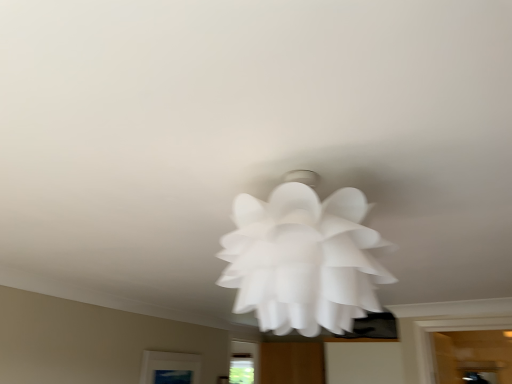
Measure the distance between point [314,274] and camera.

Point [314,274] is 79.50 centimeters away from camera.

The width and height of the screenshot is (512, 384). Describe the element at coordinates (303, 258) in the screenshot. I see `white paper flower at center` at that location.

I want to click on white paper flower at center, so click(303, 258).

This screenshot has height=384, width=512. Describe the element at coordinates (170, 368) in the screenshot. I see `matte glass window at lower center` at that location.

The width and height of the screenshot is (512, 384). Find the location of `matte glass window at lower center`. matte glass window at lower center is located at coordinates (170, 368).

You are a GUI agent. You are given a task and a screenshot of the screen. Output one action in this format:
    pyautogui.click(x=<x>, y=<y>)
    Task: Click on the white paper flower at center
    The image size is (512, 384).
    Given the screenshot: What is the action you would take?
    pyautogui.click(x=303, y=258)

Which is more to the right, white paper flower at center or matte glass window at lower center?

white paper flower at center.

Is white paper flower at center positioned behind matte glass window at lower center?

No, it is in front of matte glass window at lower center.

Which is more distant, (343, 195) or (153, 365)?

Positioned behind is point (153, 365).

From the image's perspective, is white paper flower at center located above or below matte glass window at lower center?

Clearly, from the image's perspective, white paper flower at center is above matte glass window at lower center.

From a real-world perspective, which is physically above, white paper flower at center or matte glass window at lower center?

white paper flower at center, from a real-world perspective.

Which object is thinner, white paper flower at center or matte glass window at lower center?

Thinner between the two is matte glass window at lower center.

Is white paper flower at center taller than matte glass window at lower center?

Correct, white paper flower at center is much taller as matte glass window at lower center.

Does white paper flower at center have a larger size compared to matte glass window at lower center?

Indeed, white paper flower at center has a larger size compared to matte glass window at lower center.

Does white paper flower at center contain matte glass window at lower center?

That's incorrect, matte glass window at lower center is not inside white paper flower at center.

Is white paper flower at center placed right next to matte glass window at lower center?

No.

Is white paper flower at center facing away from matte glass window at lower center?

white paper flower at center does not have its back to matte glass window at lower center.

How many degrees apart are the facing directions of white paper flower at center and matte glass window at lower center?

The angular difference between white paper flower at center and matte glass window at lower center is 89.7 degrees.

Measure the distance from white paper flower at center to matte glass window at lower center.

2.58 meters.

Where is `window below the white paper flower at center (from a real-world perspective)`? This screenshot has height=384, width=512. window below the white paper flower at center (from a real-world perspective) is located at coordinates (170, 368).

Can you confirm if matte glass window at lower center is positioned to the left of white paper flower at center?

Yes.

Is the depth of matte glass window at lower center greater than that of white paper flower at center?

Yes, matte glass window at lower center is further from the camera.

Considering the points (166, 370) and (288, 268), which point is behind, point (166, 370) or point (288, 268)?

The point (166, 370) is farther.

From the image's perspective, which one is positioned lower, matte glass window at lower center or white paper flower at center?

matte glass window at lower center, from the image's perspective.

From a real-world perspective, is matte glass window at lower center under white paper flower at center?

Correct, in the physical world, matte glass window at lower center is lower than white paper flower at center.

Looking at their sizes, would you say matte glass window at lower center is wider or thinner than white paper flower at center?

matte glass window at lower center is thinner than white paper flower at center.

Is matte glass window at lower center taller than white paper flower at center?

Incorrect, the height of matte glass window at lower center is not larger of that of white paper flower at center.

Based on their sizes in the image, would you say matte glass window at lower center is bigger or smaller than white paper flower at center?

Clearly, matte glass window at lower center is smaller in size than white paper flower at center.

Is matte glass window at lower center outside of white paper flower at center?

That's correct, matte glass window at lower center is outside of white paper flower at center.

Are matte glass window at lower center and white paper flower at center beside each other?

No, matte glass window at lower center is not next to white paper flower at center.

Is matte glass window at lower center oriented away from white paper flower at center?

No, matte glass window at lower center is not facing away from white paper flower at center.

How many degrees apart are the facing directions of matte glass window at lower center and white paper flower at center?

89.7 degrees.

In order to click on flower lying on the right of matte glass window at lower center in this screenshot , I will do `click(303, 258)`.

This screenshot has height=384, width=512. I want to click on flower above the matte glass window at lower center (from the image's perspective), so click(303, 258).

Where is `flower on the right of matte glass window at lower center`? The width and height of the screenshot is (512, 384). flower on the right of matte glass window at lower center is located at coordinates (303, 258).